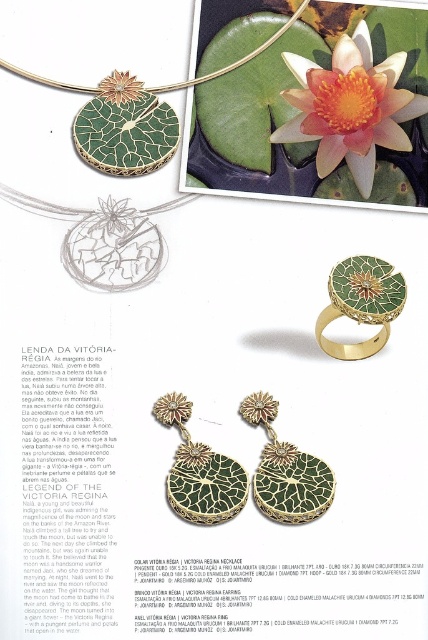
From the picture: Which is above, green mosaic earrings at center or green mosaic ring at center?

green mosaic ring at center is higher up.

Is green mosaic earrings at center wider than green mosaic ring at center?

→ Yes, green mosaic earrings at center is wider than green mosaic ring at center.

Is point (329, 468) in front of point (335, 266)?

No, it is not.

Identify the location of green mosaic earrings at center. The image size is (428, 640). (285, 470).

Which is in front, point (351, 124) or point (193, 506)?

Positioned in front is point (193, 506).

Does orange lily pad at upper center have a smaller size compared to green mosaic pendant at center?

Actually, orange lily pad at upper center might be larger than green mosaic pendant at center.

Who is more forward, (288, 61) or (181, 435)?

Positioned in front is point (181, 435).

Where is `orange lily pad at upper center`? orange lily pad at upper center is located at coordinates (350, 108).

Is green mosaic pendant at center positioned before green mosaic earrings at center?

No, it is behind green mosaic earrings at center.

Who is shorter, green mosaic pendant at center or green mosaic earrings at center?

green mosaic pendant at center

Locate an element on the screen. This screenshot has height=640, width=428. green mosaic pendant at center is located at coordinates (199, 470).

At what (x,y) coordinates should I click in order to perform the action: click on green mosaic pendant at center. Please return your answer as a coordinate pair (x, y). Looking at the image, I should click on (199, 470).